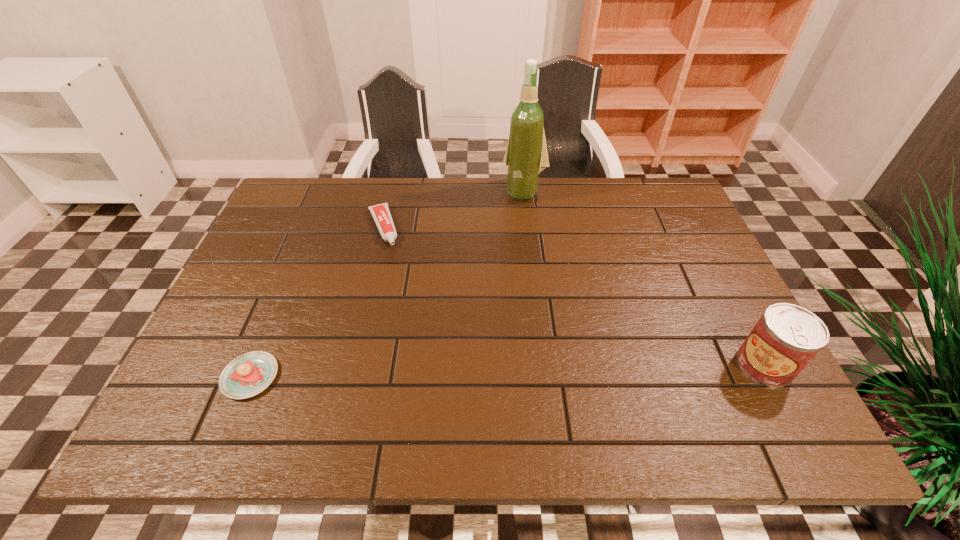
This screenshot has width=960, height=540. I want to click on the leftmost object, so click(x=249, y=374).

Find the location of a particular element. The image size is (960, 540). can is located at coordinates (787, 337).

You are a GUI agent. You are given a task and a screenshot of the screen. Output one action in this format:
    pyautogui.click(x=<x>, y=<y>)
    Task: Click on the rightmost object
    The image size is (960, 540).
    Given the screenshot: What is the action you would take?
    pyautogui.click(x=787, y=337)

Find the location of a particular element. the second farthest object is located at coordinates pos(381,214).

Image resolution: width=960 pixels, height=540 pixels. Identify the location of the second object from left to right. (381, 214).

At what (x,y) coordinates should I click in order to perform the action: click on the second object from right to left. Please return your answer as a coordinate pair (x, y). This screenshot has height=540, width=960. Looking at the image, I should click on (526, 155).

Locate an element on the screen. the farthest object is located at coordinates (526, 155).

Locate an element on the screen. free point located on the back of the leftmost object is located at coordinates (292, 276).

Where is `vacant space located on the left of the third shortest object`? The height and width of the screenshot is (540, 960). vacant space located on the left of the third shortest object is located at coordinates (672, 365).

This screenshot has height=540, width=960. Find the location of `free space located at the nozzle of the third nearest object`. free space located at the nozzle of the third nearest object is located at coordinates (399, 288).